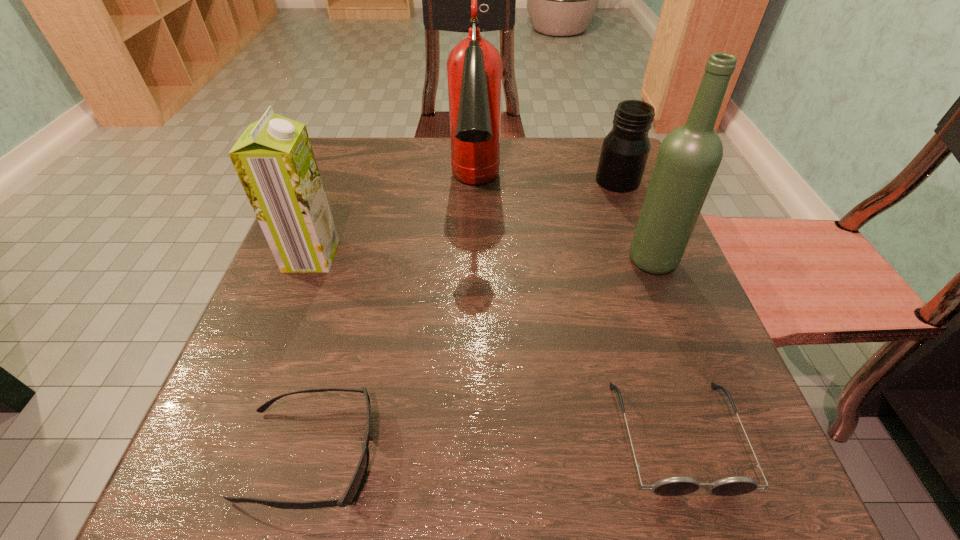
You are a GUI agent. You are given a task and a screenshot of the screen. Output one action in this format:
    pyautogui.click(x=<x>, y=<y>)
    Task: Click on the vacant space located on the front-facing side of the left sunglasses
    
    Given the screenshot: What is the action you would take?
    pyautogui.click(x=621, y=455)

Locate an element on the screen. The height and width of the screenshot is (540, 960). fire extinguisher located at the far edge is located at coordinates (474, 67).

Find the location of `jar at the far edge`. jar at the far edge is located at coordinates (625, 150).

Identify the location of soya milk located in the left edge section of the desktop. (274, 160).

What are the coordinates of `sunglasses positioned at the left edge` in the screenshot? It's located at (352, 491).

Locate an element on the screen. wine bottle located in the right edge section of the desktop is located at coordinates (689, 156).

Where is `jar present at the right edge`? jar present at the right edge is located at coordinates (625, 150).

Find the location of a particular element. sunglasses present at the right edge is located at coordinates 679,485.

The width and height of the screenshot is (960, 540). What are the coordinates of `object that is at the near left corner` in the screenshot? It's located at (352, 491).

This screenshot has height=540, width=960. I want to click on object located at the far right corner, so click(625, 150).